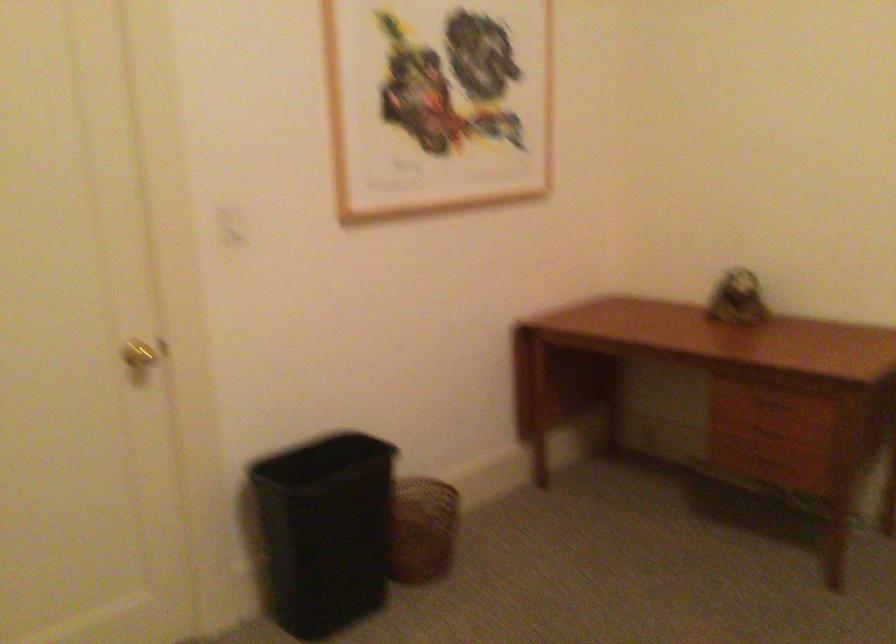
This screenshot has width=896, height=644. Identify the location of gold doorknob. (141, 357).